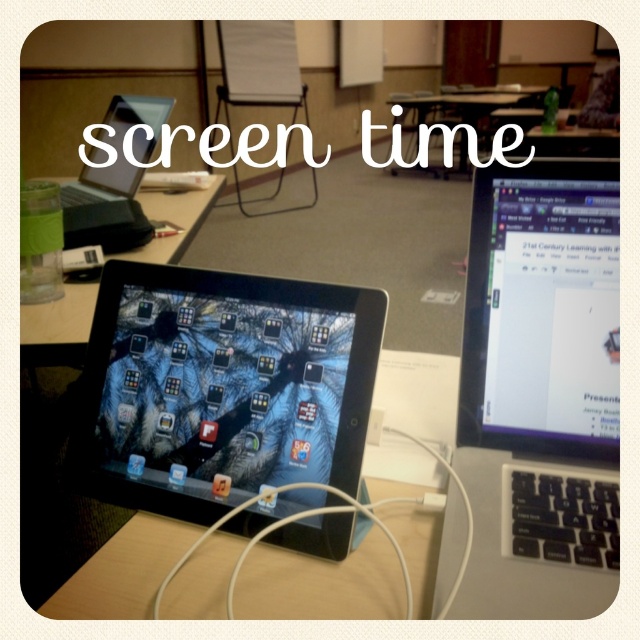
Which is behind, point (141, 148) or point (394, 140)?

The point (394, 140) is more distant.

Does matte black tablet at center come in front of wooden table at center?

Yes, matte black tablet at center is closer to the viewer.

Who is more distant from viewer, (88,241) or (445,147)?

Point (445,147)

Locate an element on the screen. Image resolution: width=640 pixels, height=640 pixels. matte black tablet at center is located at coordinates (115, 180).

The image size is (640, 640). Describe the element at coordinates (541, 392) in the screenshot. I see `sleek black laptop at right` at that location.

Who is more distant from viewer, (556, 192) or (177, 196)?

Positioned behind is point (177, 196).

Locate an element on the screen. sleek black laptop at right is located at coordinates (541, 392).

Which is above, sleek black laptop at right or black glossy tablet at center?

Positioned higher is sleek black laptop at right.

Where is `sleek black laptop at right`? This screenshot has height=640, width=640. sleek black laptop at right is located at coordinates (541, 392).